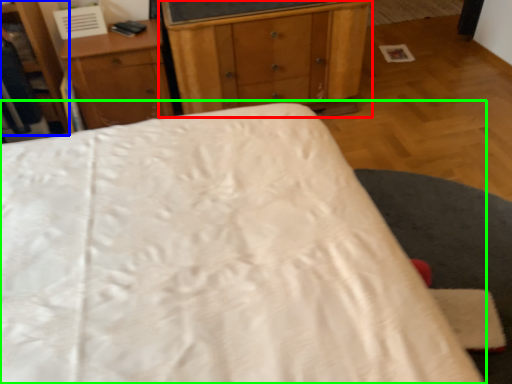
Question: Which object is positioned closest to chest of drawers (highlighted by a red box)? Select from dresser (highlighted by a blue box) and bed (highlighted by a green box).

Choices:
 (A) dresser
 (B) bed

Answer: (A)